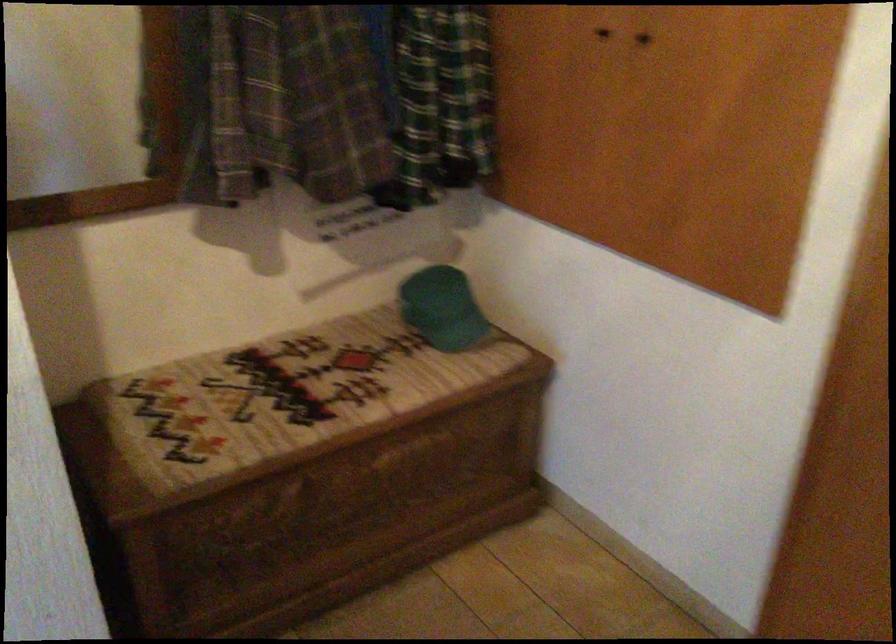
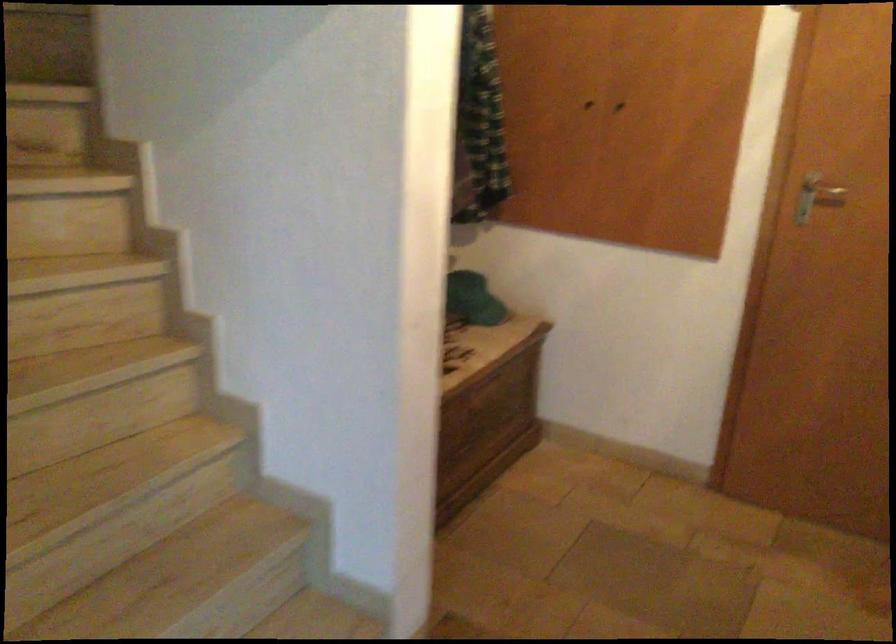
Where in the second image is the point corresponding to (x=435, y=310) from the first image?

(472, 299)